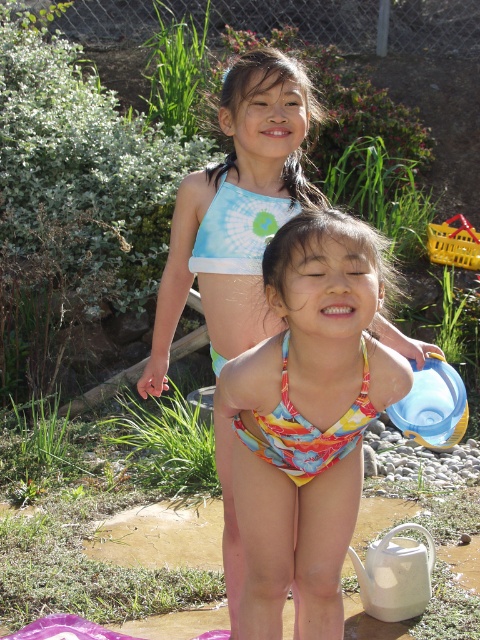
You are a photographer trying to capture a candid shot of the two children. You notice two points of interest marked as point (395, 336) and point (326, 451) in the image. Which point is positioned further back in the scene?

Point (395, 336) is behind point (326, 451), so it is positioned further back in the scene.

From the picture: Based on the coordinates provided, where exactly is the multicolored printed swimsuit at center located in the image?

The multicolored printed swimsuit at center is located at coordinates point (x=237, y=211).

You are trying to locate the multicolored fabric swimsuit at center in the image. According to the coordinates provided, where exactly is it positioned?

The multicolored fabric swimsuit at center is located at point 0.656 on the x axis and 0.640 on the y axis.